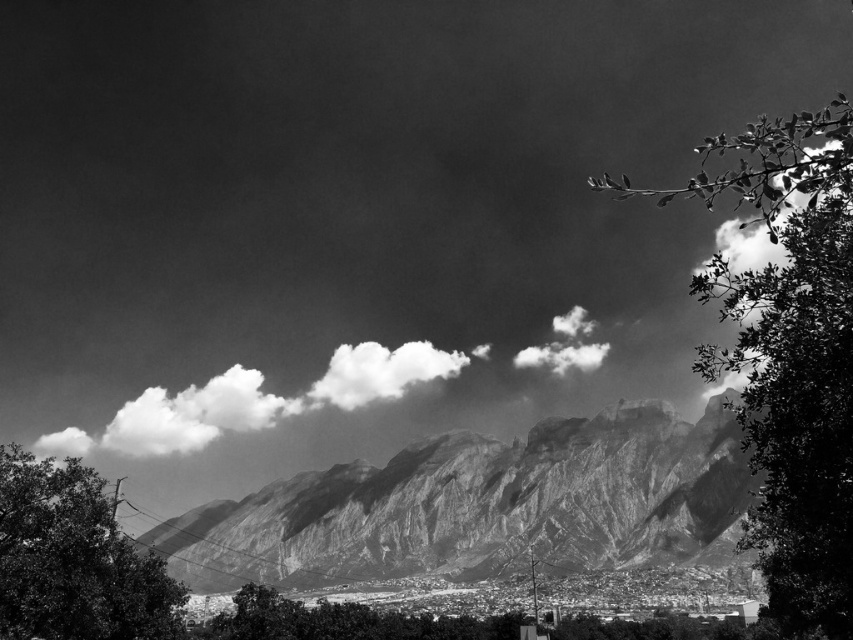
Who is shorter, green leafy tree at lower left or white fluffy cloud at center?

Standing shorter between the two is white fluffy cloud at center.

Between point (39, 563) and point (343, 381), which one is positioned behind?

The point (343, 381) is behind.

The height and width of the screenshot is (640, 853). I want to click on green leafy tree at lower left, so click(74, 560).

Which is more to the right, green leafy tree at lower left or cloudy sky at center?

From the viewer's perspective, green leafy tree at lower left appears more on the right side.

The image size is (853, 640). In order to click on green leafy tree at lower left in this screenshot , I will do `click(74, 560)`.

Find the location of a particular element. green leafy tree at lower left is located at coordinates (74, 560).

Between rugged stone mountain range at center and cloudy sky at center, which one appears on the right side from the viewer's perspective?

rugged stone mountain range at center

Between rugged stone mountain range at center and cloudy sky at center, which one has more height?

rugged stone mountain range at center is taller.

Where is `rugged stone mountain range at center`? The width and height of the screenshot is (853, 640). rugged stone mountain range at center is located at coordinates (485, 506).